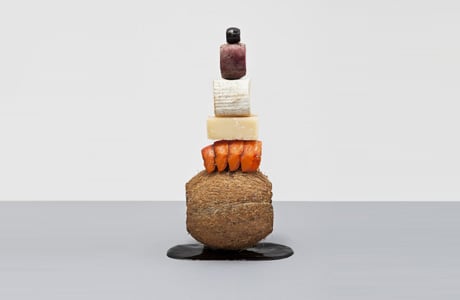
I want to click on top of stand, so click(x=231, y=33).